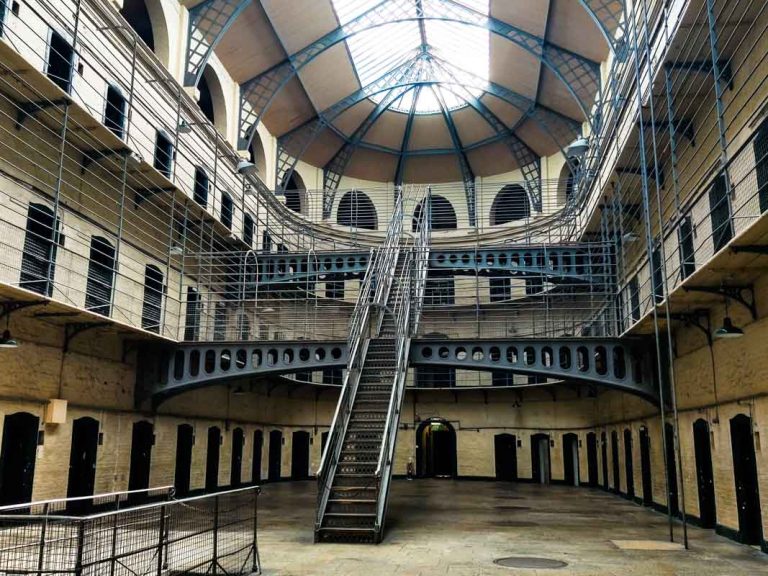
The height and width of the screenshot is (576, 768). Find the location of `circles on the floor`. circles on the floor is located at coordinates (548, 564), (514, 522), (514, 507), (514, 499).